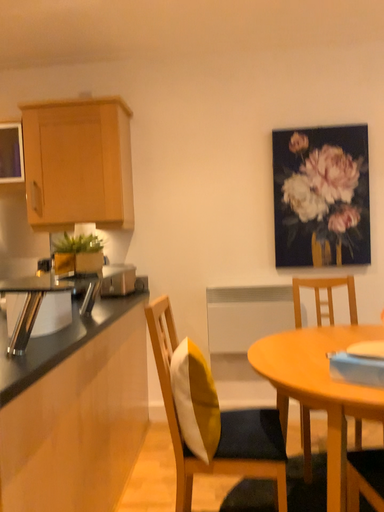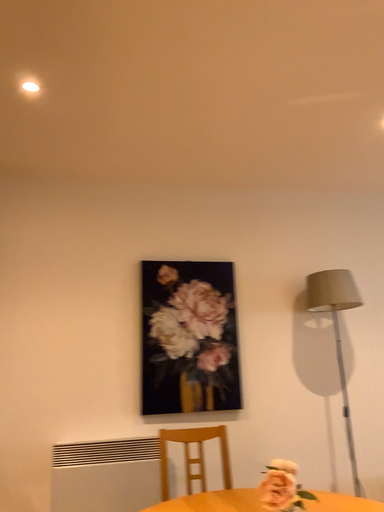
Question: How did the camera likely rotate when shooting the video?

Choices:
 (A) rotated upward
 (B) rotated downward

Answer: (A)